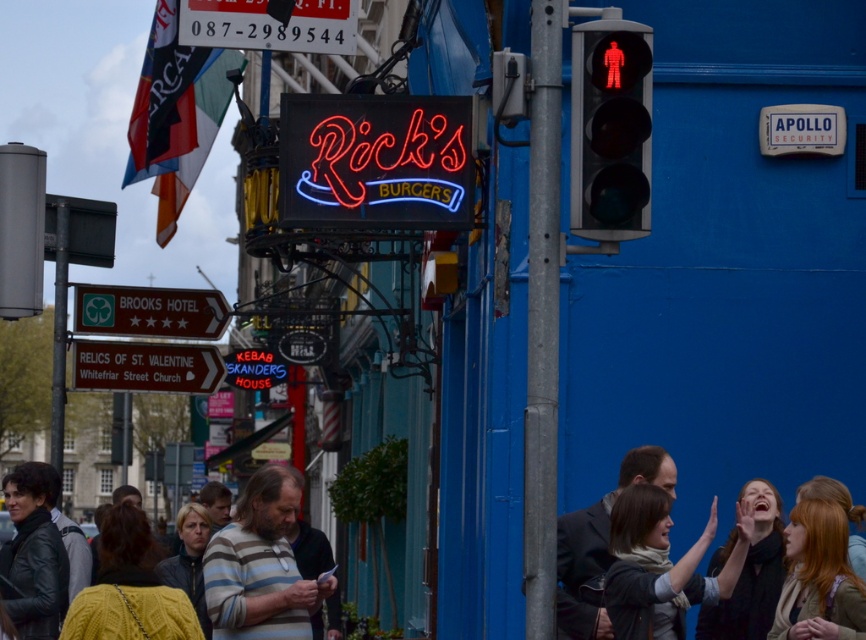
You are standing at the point labeled point (283, 604) and want to walk to the point labeled point (611, 129). According to the scene, which direction should you face to start walking towards your destination?

You should face the direction towards point (611, 129), which is in front of point (283, 604), so you should face towards the direction of the Brooks Hotel signs to reach your destination.

Based on the scene described, what does the point at coordinates (611, 129) represent?

The point at coordinates (611, 129) corresponds to the red glass pedestrian signal at right.